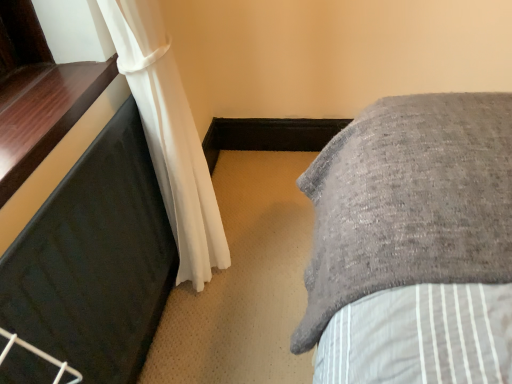
Question: From the image's perspective, is black glossy window sill at left on top of white sheer curtain at left?

Choices:
 (A) yes
 (B) no

Answer: (A)

Question: Does black glossy window sill at left appear on the right side of white sheer curtain at left?

Choices:
 (A) yes
 (B) no

Answer: (B)

Question: Can we say black glossy window sill at left lies outside white sheer curtain at left?

Choices:
 (A) yes
 (B) no

Answer: (A)

Question: Does black glossy window sill at left contain white sheer curtain at left?

Choices:
 (A) yes
 (B) no

Answer: (B)

Question: Are black glossy window sill at left and white sheer curtain at left beside each other?

Choices:
 (A) no
 (B) yes

Answer: (A)

Question: Is black glossy window sill at left bigger than white sheer curtain at left?

Choices:
 (A) yes
 (B) no

Answer: (B)

Question: Considering the relative sizes of black glossy window sill at left and black rubber mat at left in the image provided, is black glossy window sill at left smaller than black rubber mat at left?

Choices:
 (A) yes
 (B) no

Answer: (A)

Question: Is black glossy window sill at left with black rubber mat at left?

Choices:
 (A) no
 (B) yes

Answer: (A)

Question: From the image's perspective, is black glossy window sill at left located above black rubber mat at left?

Choices:
 (A) no
 (B) yes

Answer: (B)

Question: Is black glossy window sill at left positioned beyond the bounds of black rubber mat at left?

Choices:
 (A) no
 (B) yes

Answer: (B)

Question: Is black glossy window sill at left to the right of black rubber mat at left from the viewer's perspective?

Choices:
 (A) yes
 (B) no

Answer: (B)

Question: Considering the relative sizes of black glossy window sill at left and black rubber mat at left in the image provided, is black glossy window sill at left shorter than black rubber mat at left?

Choices:
 (A) no
 (B) yes

Answer: (B)

Question: Would you say white sheer curtain at left is part of black rubber mat at left's contents?

Choices:
 (A) yes
 (B) no

Answer: (B)